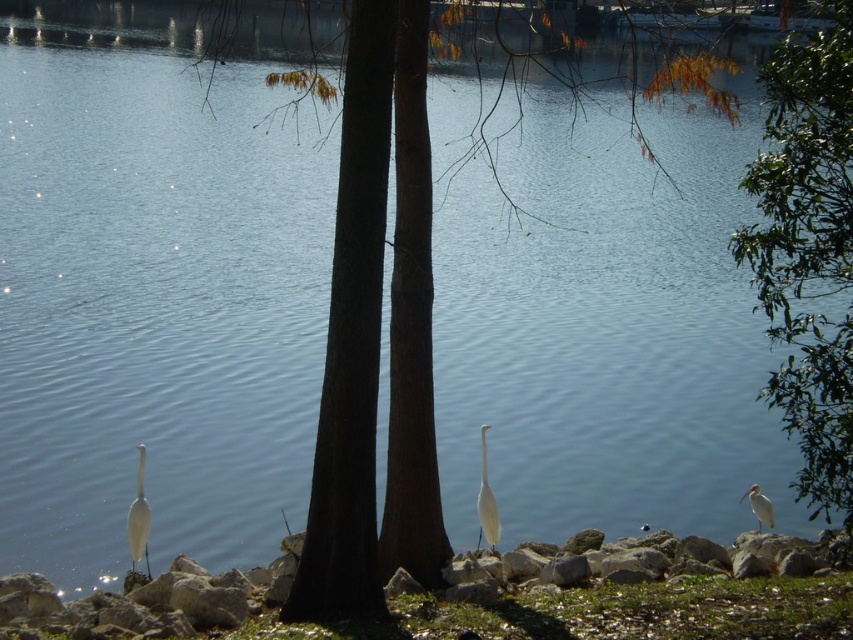
Which of these two, white matte bird at center or white matte bird at lower right, stands taller?

white matte bird at center

Describe the element at coordinates (486, 500) in the screenshot. I see `white matte bird at center` at that location.

Where is `white matte bird at center`? white matte bird at center is located at coordinates (486, 500).

Is white matte bird at lower left behind white matte bird at center?

No, white matte bird at lower left is in front of white matte bird at center.

Based on the photo, does white matte bird at lower left appear on the left side of white matte bird at center?

Yes, white matte bird at lower left is to the left of white matte bird at center.

Locate an element on the screen. white matte bird at lower left is located at coordinates (138, 518).

Who is positioned more to the left, white matte bird at lower left or white matte bird at lower right?

white matte bird at lower left

Consider the image. Is white matte bird at lower left taller than white matte bird at lower right?

Correct, white matte bird at lower left is much taller as white matte bird at lower right.

You are a GUI agent. You are given a task and a screenshot of the screen. Output one action in this format:
    pyautogui.click(x=<x>, y=<y>)
    Task: Click on the white matte bird at lower left
    This screenshot has width=853, height=640.
    Given the screenshot: What is the action you would take?
    pyautogui.click(x=138, y=518)

Identify the location of white matte bird at lower left. (138, 518).